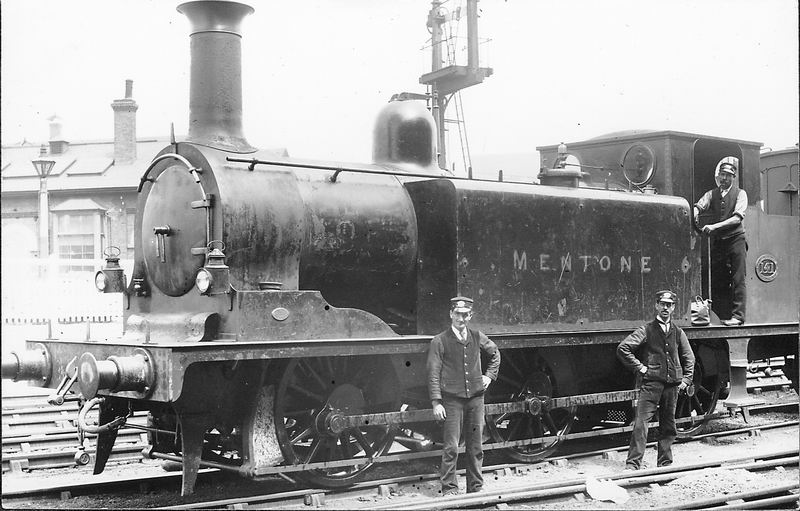
I want to click on rod, so click(394, 419).